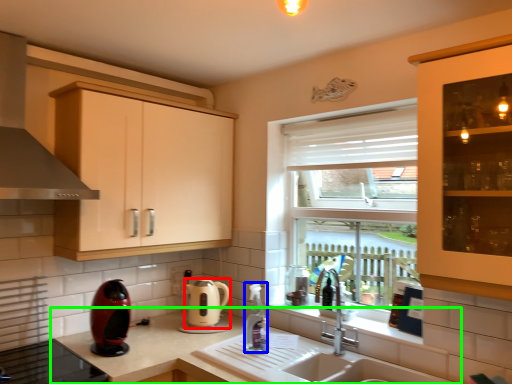
Question: Which is nearer to the kitchen appliance (highlighted by a red box)? bottle (highlighted by a blue box) or countertop (highlighted by a green box).

Choices:
 (A) bottle
 (B) countertop

Answer: (B)